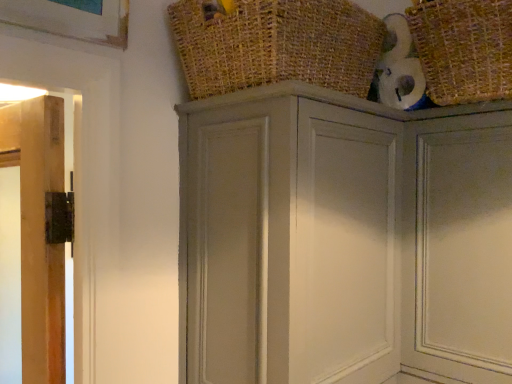
Question: Does matte gray door at upper right have a smaller size compared to burlap basket at upper center, placed as the first basket when sorted from left to right?

Choices:
 (A) no
 (B) yes

Answer: (B)

Question: From a real-world perspective, is matte gray door at upper right positioned under burlap basket at upper center, placed as the first basket when sorted from left to right, based on gravity?

Choices:
 (A) yes
 (B) no

Answer: (A)

Question: Could burlap basket at upper center, placed as the first basket when sorted from left to right, be considered to be inside matte gray door at upper right?

Choices:
 (A) no
 (B) yes

Answer: (A)

Question: Is matte gray door at upper right bigger than burlap basket at upper center, placed as the first basket when sorted from left to right?

Choices:
 (A) yes
 (B) no

Answer: (B)

Question: Is matte gray door at upper right positioned before burlap basket at upper center, placed as the first basket when sorted from left to right?

Choices:
 (A) no
 (B) yes

Answer: (A)

Question: From a real-world perspective, is burlap basket at upper center, the second basket viewed from the right, physically located above or below matte gray door at upper right?

Choices:
 (A) below
 (B) above

Answer: (B)

Question: Is burlap basket at upper center, the second basket viewed from the right, in front of or behind matte gray door at upper right in the image?

Choices:
 (A) front
 (B) behind

Answer: (A)

Question: Is point [x=306, y=13] closer or farther from the camera than point [x=480, y=355]?

Choices:
 (A) closer
 (B) farther

Answer: (A)

Question: Based on their sizes in the image, would you say burlap basket at upper center, placed as the first basket when sorted from left to right, is bigger or smaller than matte gray door at upper right?

Choices:
 (A) big
 (B) small

Answer: (A)

Question: Is burlap basket at upper center, placed as the first basket when sorted from left to right, bigger or smaller than matte gray cupboard at upper center?

Choices:
 (A) big
 (B) small

Answer: (B)

Question: Is point (339, 39) closer or farther from the camera than point (265, 137)?

Choices:
 (A) closer
 (B) farther

Answer: (B)

Question: From the image's perspective, relative to matte gray cupboard at upper center, is burlap basket at upper center, placed as the first basket when sorted from left to right, above or below?

Choices:
 (A) above
 (B) below

Answer: (A)

Question: Do you think burlap basket at upper center, the second basket viewed from the right, is within matte gray cupboard at upper center, or outside of it?

Choices:
 (A) inside
 (B) outside

Answer: (B)

Question: Looking at the image, does burlap basket at upper center, placed as the first basket when sorted from left to right, seem bigger or smaller compared to woven straw basket at upper right, which is counted as the 1th basket, starting from the right?

Choices:
 (A) big
 (B) small

Answer: (A)

Question: Is burlap basket at upper center, the second basket viewed from the right, to the left or to the right of woven straw basket at upper right, which is counted as the 1th basket, starting from the right, in the image?

Choices:
 (A) right
 (B) left

Answer: (B)